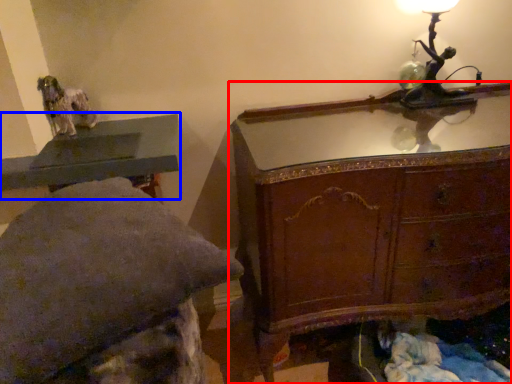
Question: Among these objects, which one is nearest to the camera, chest of drawers (highlighted by a red box) or table (highlighted by a blue box)?

Choices:
 (A) chest of drawers
 (B) table

Answer: (A)